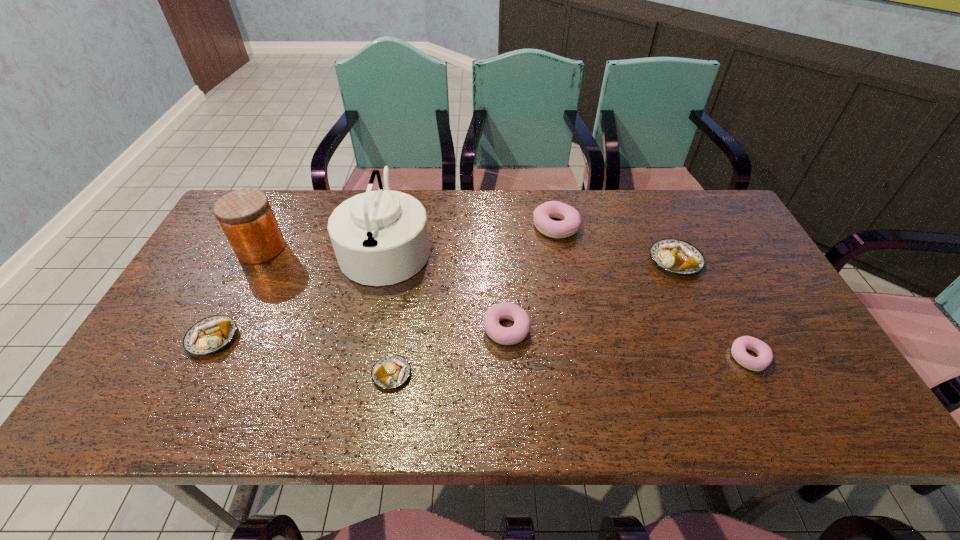
This screenshot has height=540, width=960. What are the coordinates of `object that is at the far left corner` in the screenshot? It's located at (246, 217).

I want to click on vacant region at the far edge, so click(x=433, y=235).

You are a GUI agent. You are given a task and a screenshot of the screen. Output one action in this format:
    pyautogui.click(x=<x>, y=<y>)
    Task: Click on the free space at the near edge of the desktop
    This screenshot has width=960, height=540.
    Given the screenshot: What is the action you would take?
    pyautogui.click(x=548, y=401)

This screenshot has height=540, width=960. I want to click on vacant region at the right edge of the desktop, so click(808, 341).

Locate an element on the screen. The width and height of the screenshot is (960, 540). vacant space at the near left corner of the desktop is located at coordinates (189, 390).

Locate an element on the screen. free space at the far right corner of the desktop is located at coordinates point(674,200).

Identify the location of vacant area that lies between the white kettle and the farthest pastry. (471, 237).

The height and width of the screenshot is (540, 960). In order to click on free space between the rightmost pink pastry and the fifth pastry from right to left in this screenshot , I will do `click(570, 366)`.

Where is `free space between the fifth pastry from right to left and the farthest pastry`? free space between the fifth pastry from right to left and the farthest pastry is located at coordinates (474, 300).

Locate an element on the screen. empty space that is in between the smallest brown pastry and the leftmost pastry is located at coordinates (302, 356).